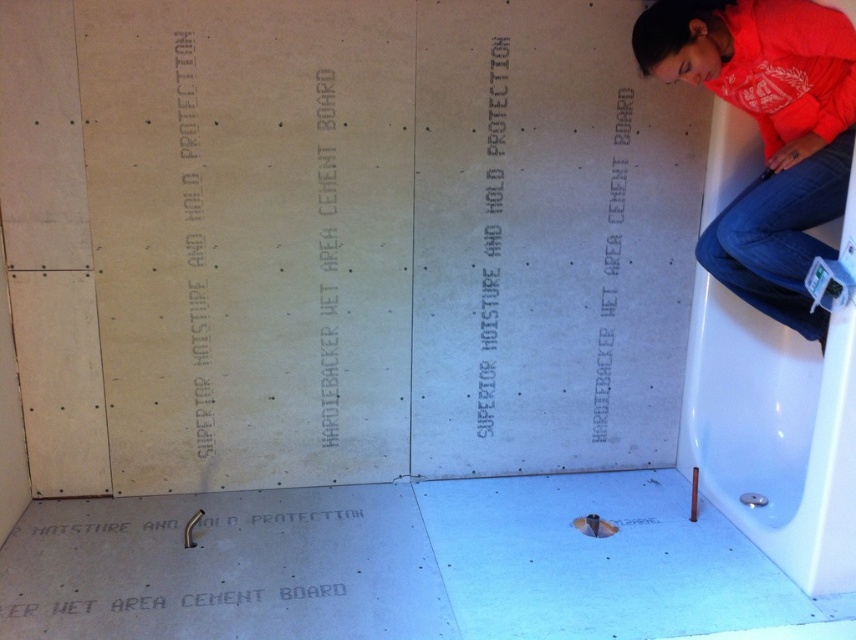
What do you see at coordinates (491, 232) in the screenshot? The image size is (856, 640). I see `white matte text at center` at bounding box center [491, 232].

You are a GUI agent. You are given a task and a screenshot of the screen. Output one action in this format:
    pyautogui.click(x=<x>, y=<y>)
    Task: Click on the white matte text at center
    The image size is (856, 640).
    Given the screenshot: What is the action you would take?
    pyautogui.click(x=491, y=232)

At what (x,y) coordinates should I click in order to perform the action: click on white matte text at center. Please return your answer as a coordinate pair (x, y). Looking at the image, I should click on (491, 232).

Who is higher up, white matte writing at upper left or white matte cement board at upper right?

white matte writing at upper left is above.

Who is shorter, white matte writing at upper left or white matte cement board at upper right?

white matte cement board at upper right

What do you see at coordinates (189, 145) in the screenshot? Image resolution: width=856 pixels, height=640 pixels. I see `white matte writing at upper left` at bounding box center [189, 145].

Find the location of a particular element. white matte writing at upper left is located at coordinates (189, 145).

Can you confirm if orange cotton shirt at upper right is shorter than white matte hardiebacker wet area cement board at center?

Indeed, orange cotton shirt at upper right has a lesser height compared to white matte hardiebacker wet area cement board at center.

Is orange cotton shirt at upper right wider than white matte hardiebacker wet area cement board at center?

Yes, orange cotton shirt at upper right is wider than white matte hardiebacker wet area cement board at center.

Between point (797, 314) and point (318, 209), which one is positioned behind?

Positioned behind is point (318, 209).

You are a GUI agent. You are given a task and a screenshot of the screen. Output one action in this format:
    pyautogui.click(x=<x>, y=<y>)
    Task: Click on the orange cotton shirt at upper right
    
    Given the screenshot: What is the action you would take?
    pyautogui.click(x=767, y=132)